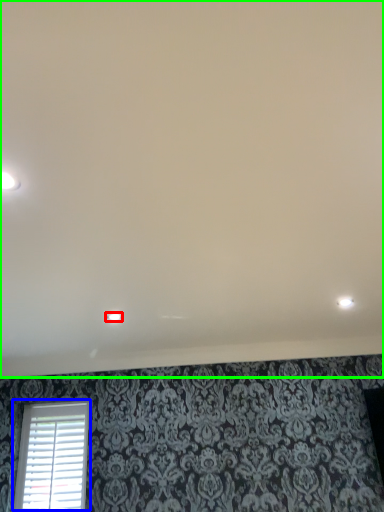
Question: Considering the real-world distances, which object is farthest from dot (highlighted by a red box)? window (highlighted by a blue box) or backdrop (highlighted by a green box)?

Choices:
 (A) window
 (B) backdrop

Answer: (A)